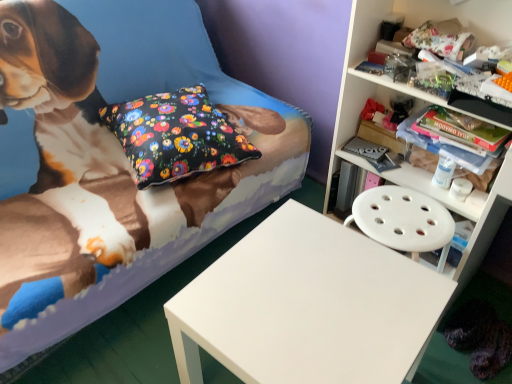
Where is `empty space that is ontop of white matte table at center (from a real-world perspective)`? The width and height of the screenshot is (512, 384). empty space that is ontop of white matte table at center (from a real-world perspective) is located at coordinates (318, 296).